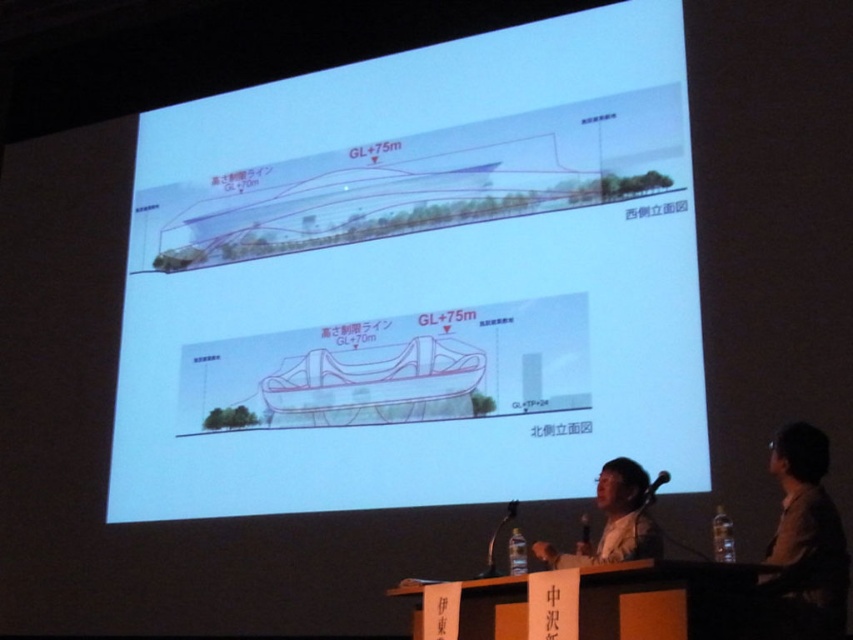
You are an architect attending a presentation and see the brown shirt at right and the matte black person at lower center on the screen. Which person is positioned lower in the image?

The brown shirt at right is located below the matte black person at lower center in the image.

You are an architect reviewing a presentation. You notice the white paper at center and the matte black person at lower center. Which object is wider in this scene?

The white paper at center might be wider than matte black person at lower center according to the description.